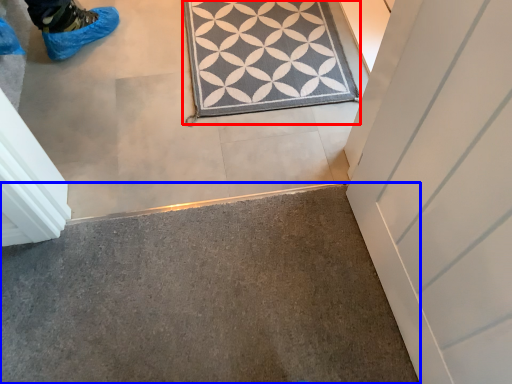
Question: Which of the following is the farthest to the observer, doormat (highlighted by a red box) or concrete (highlighted by a blue box)?

Choices:
 (A) doormat
 (B) concrete

Answer: (A)